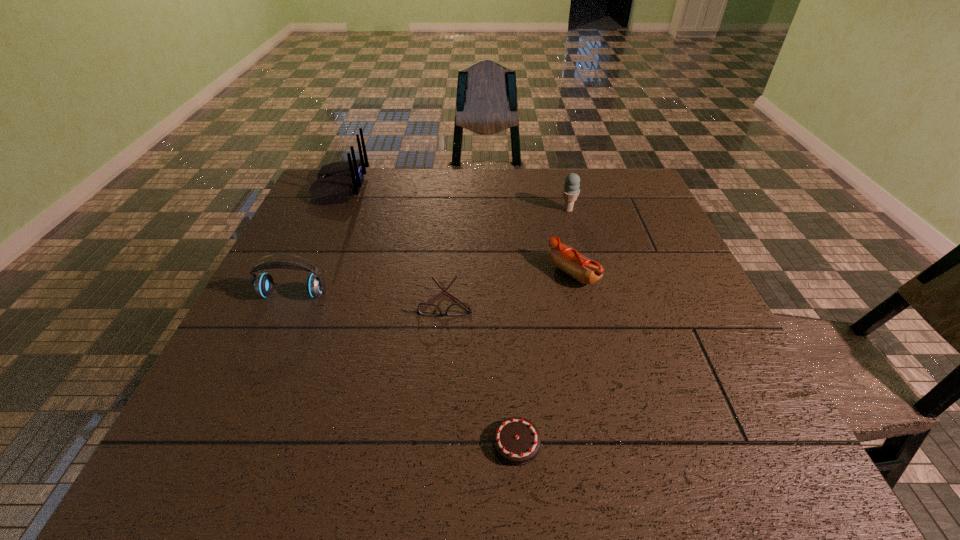
The width and height of the screenshot is (960, 540). What are the coordinates of `free space between the ice cream and the sausage` in the screenshot? It's located at (570, 241).

Image resolution: width=960 pixels, height=540 pixels. I want to click on empty space between the headset and the router, so click(x=317, y=240).

Locate an element on the screen. Image resolution: width=960 pixels, height=540 pixels. empty space between the third shortest object and the headset is located at coordinates (433, 284).

Locate an element on the screen. The image size is (960, 540). vacant space that's between the third shortest object and the router is located at coordinates (457, 230).

The image size is (960, 540). In order to click on object that stands as the closest to the sausage in this screenshot , I will do pos(427,309).

Identify which object is the fourth closest to the ice cream. Please provide its 2D coordinates. Your answer should be formatted as a tuple, i.e. [(x, y)], where the tuple contains the x and y coordinates of a point satisfying the conditions above.

[(516, 440)]

Identify the location of free space in the image that satisfies the following two spatial constraints: 1. on the back of the tallest object; 2. on the left side of the ice cream. The width and height of the screenshot is (960, 540). (330, 210).

Where is `vacant area in the image that satisfies the following two spatial constraints: 1. on the back of the tallest object; 2. on the right side of the ice cream`? The image size is (960, 540). vacant area in the image that satisfies the following two spatial constraints: 1. on the back of the tallest object; 2. on the right side of the ice cream is located at coordinates (330, 210).

Identify the location of vacant space that satisfies the following two spatial constraints: 1. on the front-facing side of the fourth object from left to right; 2. on the left side of the third object from left to right. This screenshot has width=960, height=540. (434, 443).

At what (x,y) coordinates should I click in order to perform the action: click on vacant area that satisfies the following two spatial constraints: 1. on the back of the sausage; 2. on the right side of the router. Please return your answer as a coordinate pair (x, y). The width and height of the screenshot is (960, 540). Looking at the image, I should click on (301, 273).